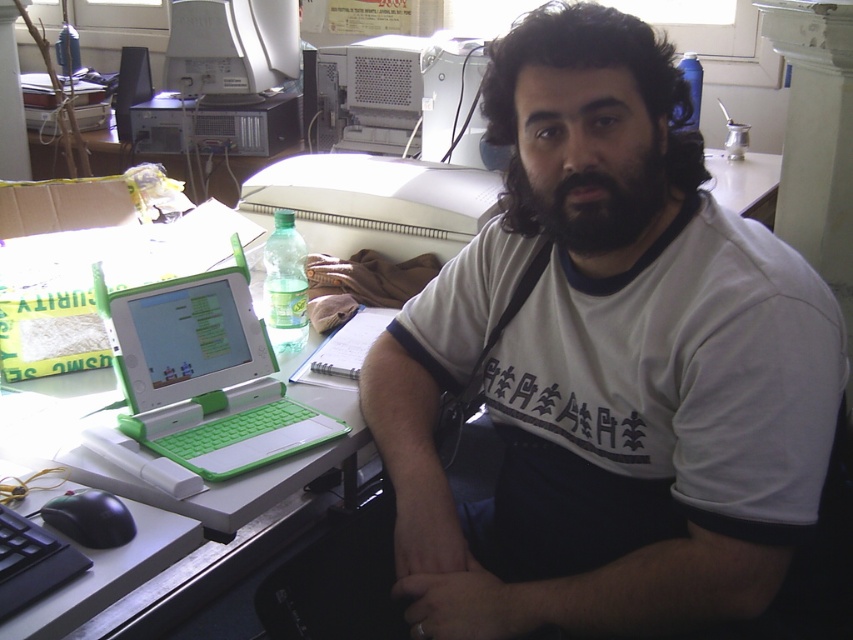
Question: Can you confirm if green plastic laptop at left is wider than black plastic keyboard at lower left?

Choices:
 (A) yes
 (B) no

Answer: (A)

Question: Which is nearer to the white plastic monitor at upper center?

Choices:
 (A) white plastic desktop computer at upper center
 (B) dark brown fuzzy beard at center
 (C) black plastic keyboard at lower left

Answer: (A)

Question: Is the position of green plastic laptop at left less distant than that of dark brown fuzzy beard at center?

Choices:
 (A) no
 (B) yes

Answer: (A)

Question: Is dark blue fabric at lower center smaller than dark brown fuzzy beard at center?

Choices:
 (A) no
 (B) yes

Answer: (A)

Question: Which is farther from the dark brown fuzzy beard at center?

Choices:
 (A) white cotton t-shirt at center
 (B) dark blue fabric at lower center
 (C) white plastic monitor at upper center
 (D) green plastic laptop at left

Answer: (C)

Question: Which object is the closest to the dark blue fabric at lower center?

Choices:
 (A) white plastic monitor at upper center
 (B) white cotton t-shirt at center
 (C) green plastic laptop at left

Answer: (B)